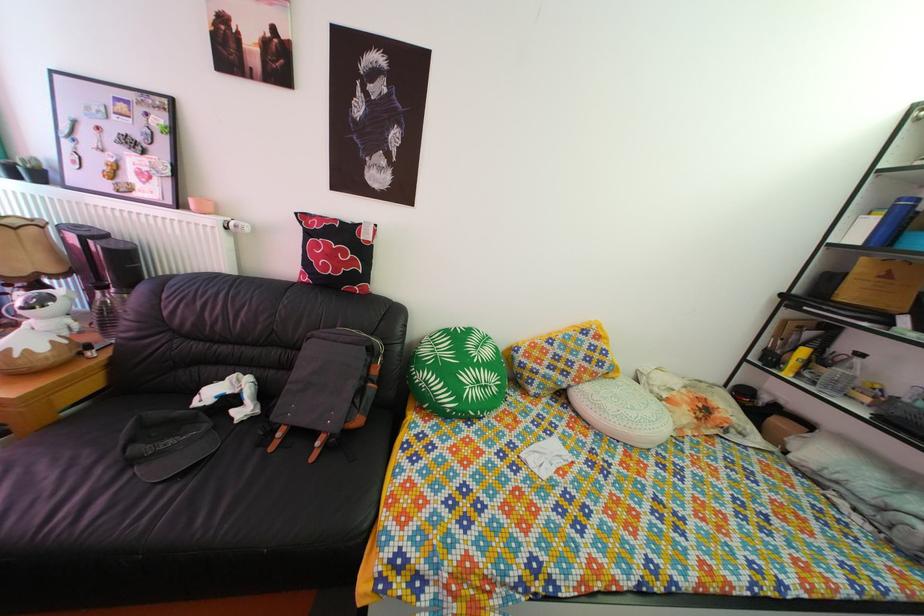
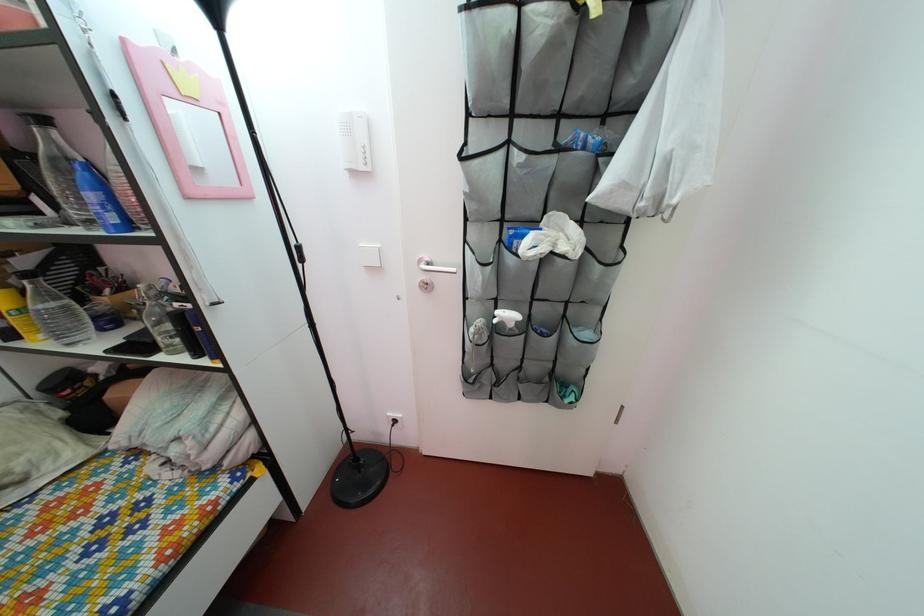
The point at (x=818, y=342) is marked in the first image. Where is the corresponding point in the second image?

(32, 270)